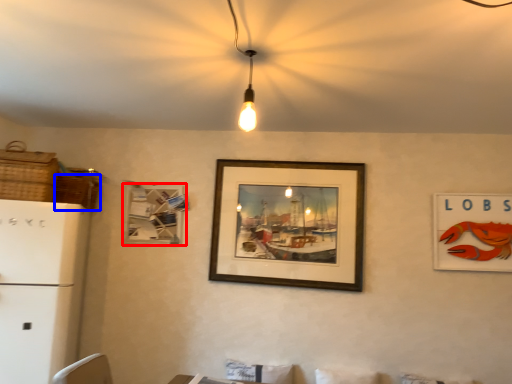
Question: Which object is closer to the camera taking this photo, picture frame (highlighted by a red box) or basket (highlighted by a blue box)?

Choices:
 (A) picture frame
 (B) basket

Answer: (B)